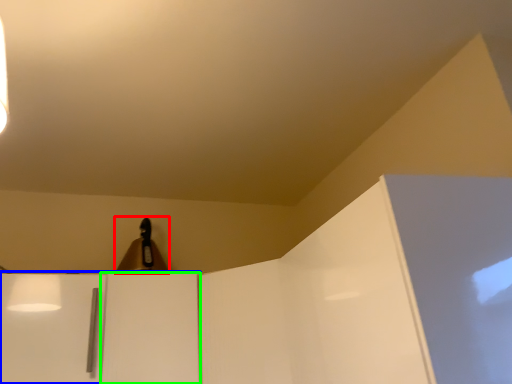
Question: Estimate the real-world distances between objects in this image. Which object is closer to lamp (highlighted by a red box), cabinetry (highlighted by a blue box) or door (highlighted by a green box)?

Choices:
 (A) cabinetry
 (B) door

Answer: (B)